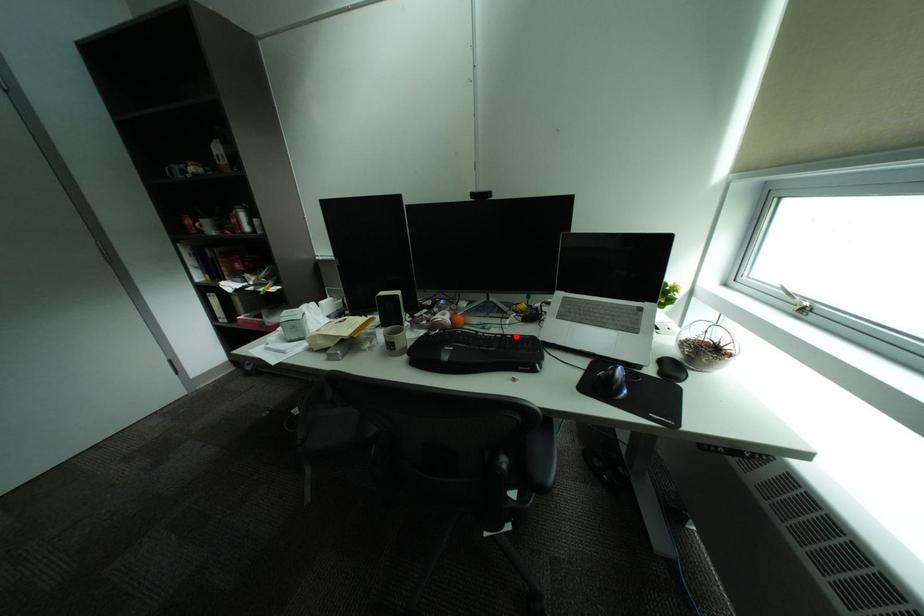
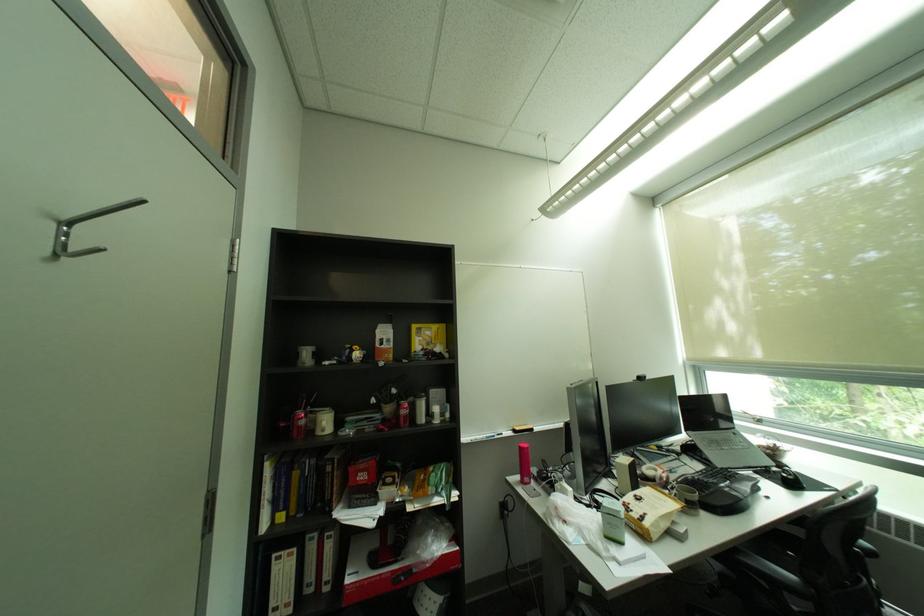
In the second image, find the point that corresponds to the highlighted location in the first image.

(712, 472)